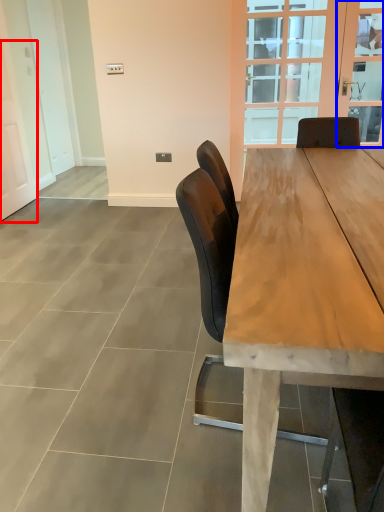
Question: Which object is further to the camera taking this photo, screen door (highlighted by a red box) or window screen (highlighted by a blue box)?

Choices:
 (A) screen door
 (B) window screen

Answer: (B)